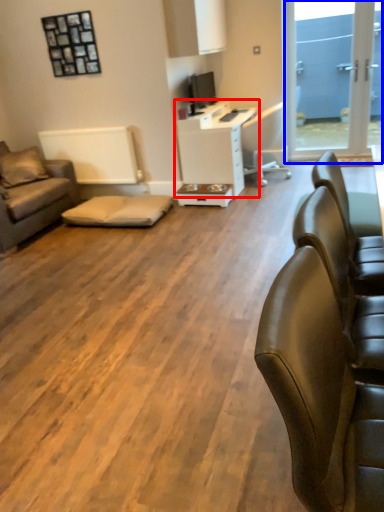
Question: Which of the following is the closest to the observer, desk (highlighted by a red box) or window screen (highlighted by a blue box)?

Choices:
 (A) desk
 (B) window screen

Answer: (A)